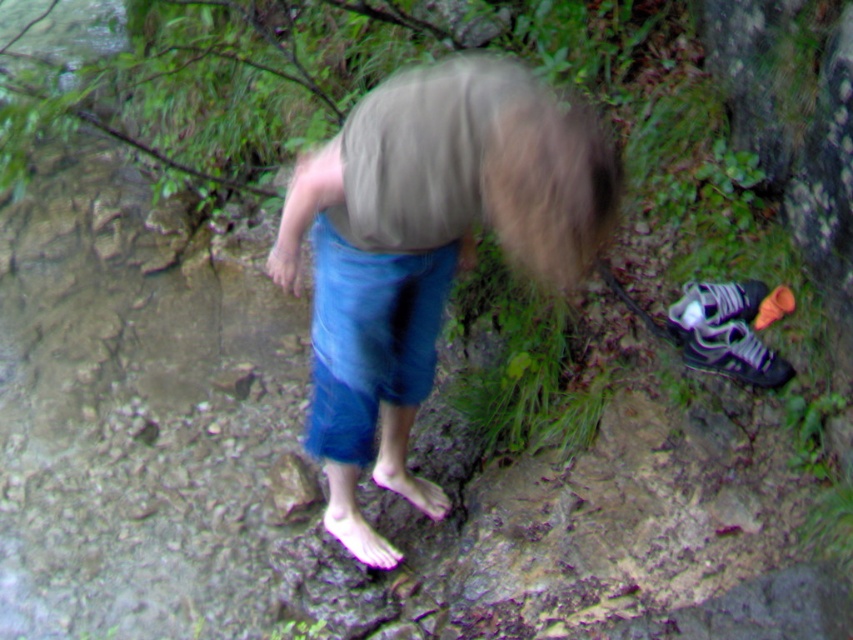
Question: Does black mesh shoe at lower right appear on the left side of shiny purple sneaker at lower right?

Choices:
 (A) yes
 (B) no

Answer: (B)

Question: Among these objects, which one is farthest from the camera?

Choices:
 (A) black mesh shoe at lower right
 (B) shiny purple sneaker at lower right

Answer: (B)

Question: Can you confirm if black mesh shoe at lower right is positioned below shiny purple sneaker at lower right?

Choices:
 (A) yes
 (B) no

Answer: (A)

Question: Is black mesh shoe at lower right to the left of shiny purple sneaker at lower right from the viewer's perspective?

Choices:
 (A) no
 (B) yes

Answer: (A)